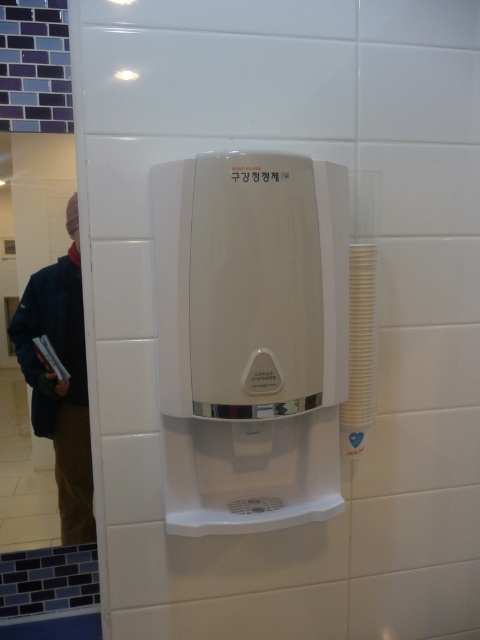
You are a maintenance worker who needs to reach both the white plastic water heater at center and the dark blue denim jacket at left. Your tool box is 60 centimeters wide. Can you place your toolbox between them without moving either object?

The distance between the white plastic water heater at center and the dark blue denim jacket at left is 51.11 centimeters. Since the toolbox is 60 centimeters wide, it cannot fit between them as the available space is narrower than the tool box.

You are standing in a bathroom and see the white plastic water heater at center and the dark blue denim jacket at left. Which object is nearer to you?

The white plastic water heater at center is closer to the viewer than the dark blue denim jacket at left.

Consider the image. You are standing in front of the wall with the gargle dispenser. There is a point marked at coordinates [250,339]. What object is located at this point?

The point at coordinates [250,339] corresponds to the white plastic water heater at center.